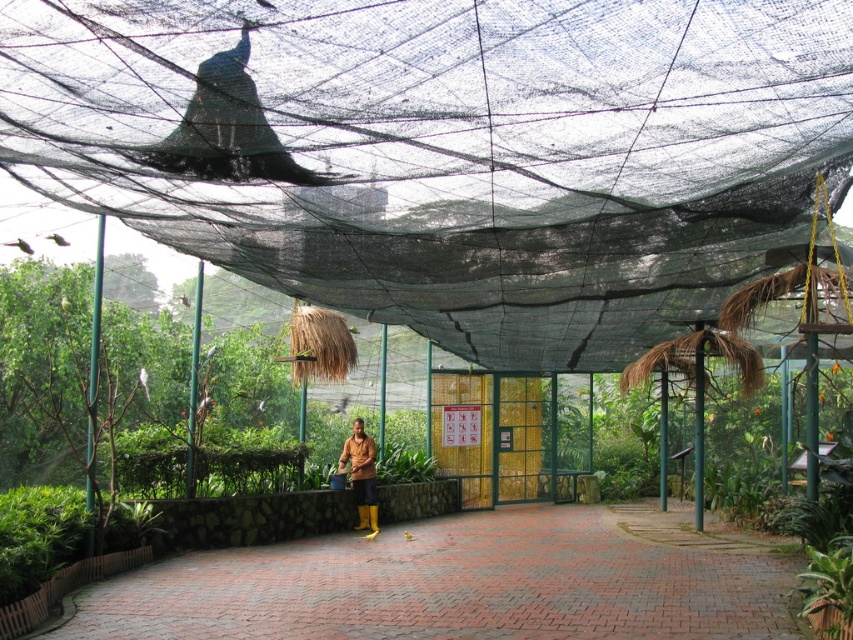
Between black mesh net at upper center and brown rubber boots at center, which one appears on the right side from the viewer's perspective?

brown rubber boots at center is more to the right.

Which of these two, black mesh net at upper center or brown rubber boots at center, stands shorter?

black mesh net at upper center

Between point (648, 92) and point (363, 449), which one is positioned behind?

Positioned behind is point (363, 449).

Locate an element on the screen. This screenshot has width=853, height=640. black mesh net at upper center is located at coordinates (447, 148).

Who is lower down, brick paved path at center or brown rubber boots at center?

brick paved path at center is below.

In the scene shown: Which of these two, brick paved path at center or brown rubber boots at center, stands taller?

Standing taller between the two is brown rubber boots at center.

Is point (524, 566) farther from camera compared to point (361, 424)?

No, it is in front of (361, 424).

This screenshot has height=640, width=853. What are the coordinates of `brick paved path at center` in the screenshot? It's located at (463, 582).

Describe the element at coordinates (828, 593) in the screenshot. Image resolution: width=853 pixels, height=640 pixels. I see `green leafy plant at lower right` at that location.

Between point (827, 627) and point (364, 484), which one is positioned in front?

Point (827, 627) is in front.

You are a GUI agent. You are given a task and a screenshot of the screen. Output one action in this format:
    pyautogui.click(x=<x>, y=<y>)
    Task: Click on the green leafy plant at lower right
    This screenshot has height=640, width=853.
    Given the screenshot: What is the action you would take?
    pyautogui.click(x=828, y=593)